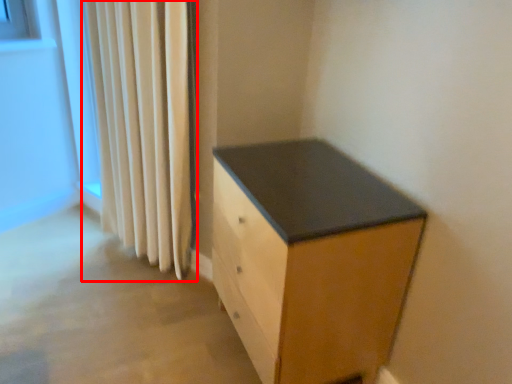
Question: From the image's perspective, what is the correct spatial relationship of curtain (annotated by the red box) in relation to chest of drawers?

Choices:
 (A) below
 (B) above

Answer: (B)